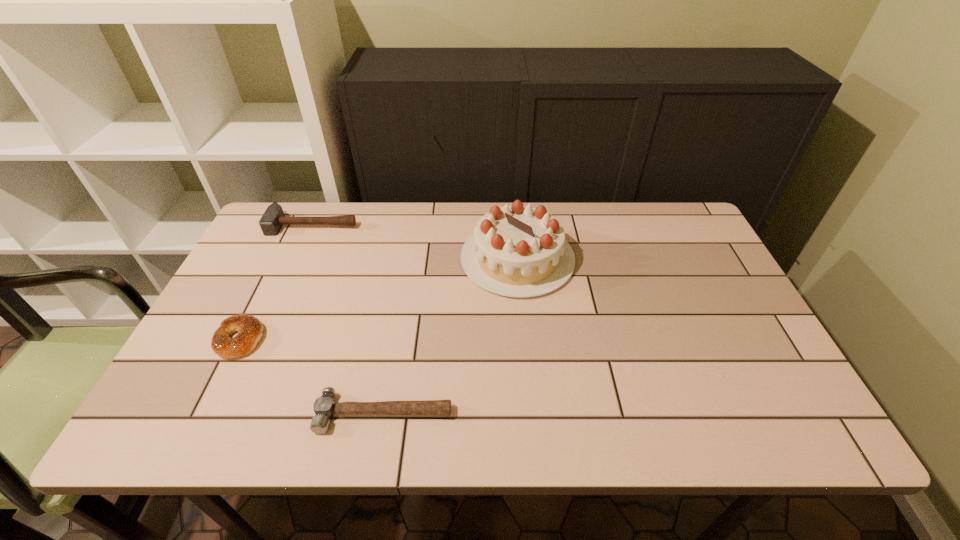
Locate an element on the screen. The width and height of the screenshot is (960, 540). birthday cake that is at the far edge is located at coordinates (517, 251).

This screenshot has width=960, height=540. Identify the location of hammer that is at the far edge. (273, 219).

Identify the location of object that is at the near edge. (324, 407).

Find the location of a particular element. The width and height of the screenshot is (960, 540). hammer that is at the left edge is located at coordinates (273, 219).

Identify the location of bagel that is at the left edge. (249, 328).

Locate an element on the screen. This screenshot has width=960, height=540. object that is at the far left corner is located at coordinates point(273,219).

In the image, there is a desktop. Identify the location of vacant space at the far edge. Image resolution: width=960 pixels, height=540 pixels. (602, 206).

Identify the location of vacant space at the near edge. Image resolution: width=960 pixels, height=540 pixels. (464, 409).

The image size is (960, 540). Find the location of `vacant region at the left edge of the desktop`. vacant region at the left edge of the desktop is located at coordinates (234, 380).

Image resolution: width=960 pixels, height=540 pixels. In order to click on free location at the right edge of the desktop in this screenshot , I will do pos(665,260).